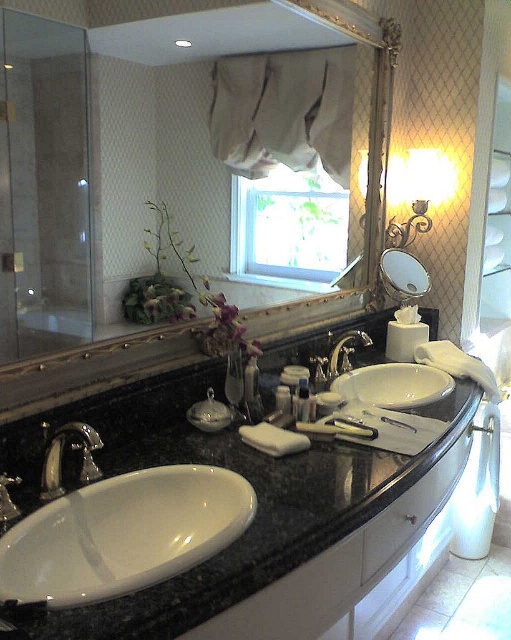
You are standing in front of the bathroom vanity and see two points marked on the mirror. Which point is closer to you, point [343,342] or point [274,406]?

Point [343,342] is closer to you because it is further to the viewer than point [274,406].